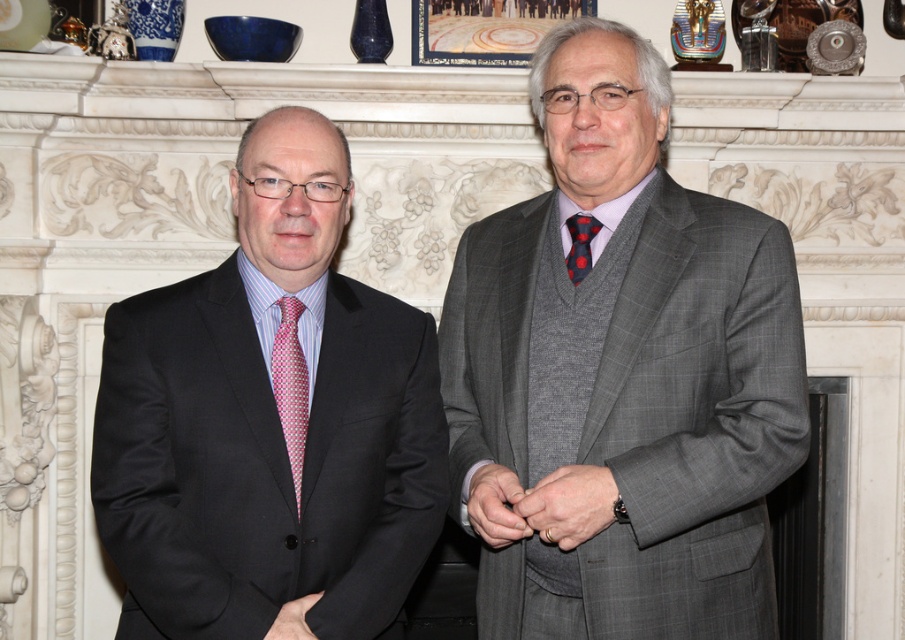
Question: Does gray wool suit at center come in front of pink dotted tie at left?

Choices:
 (A) no
 (B) yes

Answer: (B)

Question: Which is farther from the matte black suit at center?

Choices:
 (A) pink dotted tie at left
 (B) smooth gray suit at center

Answer: (B)

Question: Which object is closer to the camera taking this photo?

Choices:
 (A) matte black hand at center
 (B) pink dotted tie at left
 (C) smooth gray suit at center

Answer: (A)

Question: Does smooth gray suit at center have a larger size compared to polka dot silk tie at center?

Choices:
 (A) no
 (B) yes

Answer: (B)

Question: Which object is closer to the camera taking this photo?

Choices:
 (A) matte gray suit at center
 (B) gray wool suit at center

Answer: (B)

Question: Is matte gray suit at center closer to camera compared to polka dot silk tie at center?

Choices:
 (A) no
 (B) yes

Answer: (B)